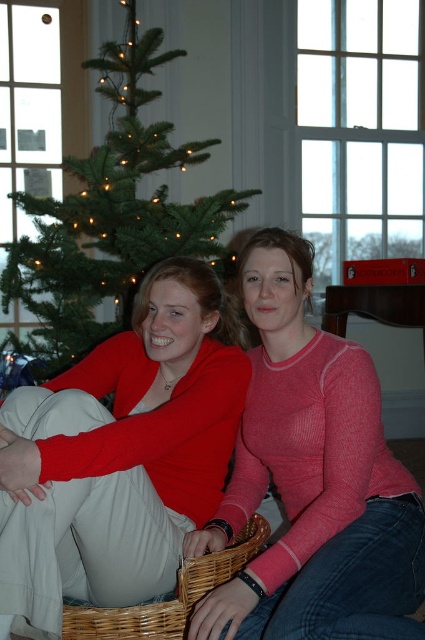
You are a photographer setting up a shoot in the scene described. You need to ensure that the matte red sweater at center and the green matte christmas tree at center are both in focus. Given that your camera can only focus on objects with a minimum thickness of 10 cm, will both objects meet this requirement?

The matte red sweater at center is thinner than the green matte christmas tree at center. Since the camera requires a minimum thickness of 10 cm and the sweater is thinner than the tree, if the tree meets the requirement, the sweater might not. However, without exact measurements, we can only confirm the sweater is thinner than the tree. The answer depends on the tree being at least 10 cm thick. If the tree is over 10 cm, the sweater could still be under, so it might not meet the requirement.

You are trying to decide which item to place in a storage box that can only hold items narrower than the woven brown basket at lower center. Given that the pink ribbed sweater at center is wider than the basket, will the sweater fit in the box?

The pink ribbed sweater at center is wider than the woven brown basket at lower center, so it will not fit in the storage box designed for items narrower than the basket.